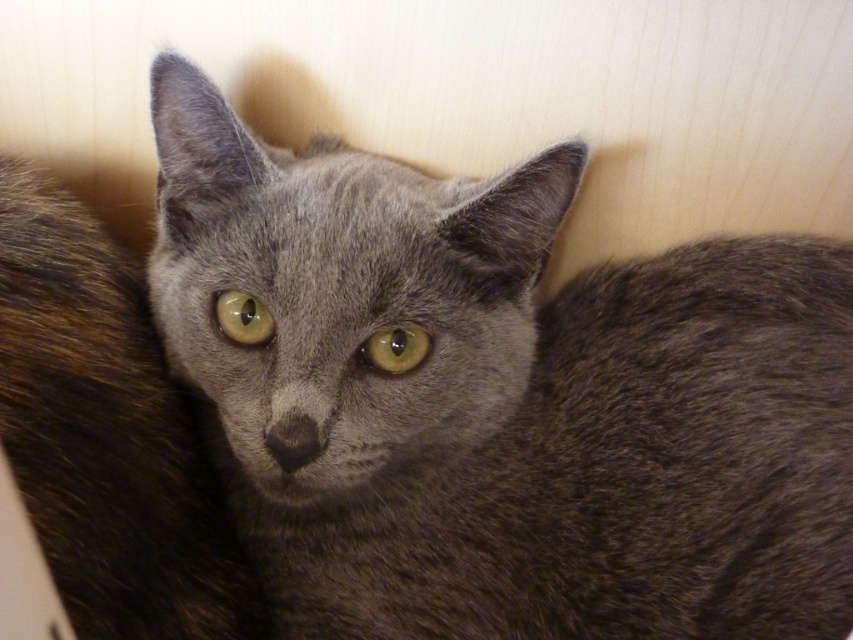
Is point (413, 346) closer to viewer compared to point (236, 316)?

No.

From the picture: Is yellow-green eye at center closer to camera compared to green glossy eye at center?

That is True.

Is point (397, 360) more distant than point (213, 298)?

No, it is in front of (213, 298).

You are a GUI agent. You are given a task and a screenshot of the screen. Output one action in this format:
    pyautogui.click(x=<x>, y=<y>)
    Task: Click on the yellow-green eye at center
    Image resolution: width=853 pixels, height=640 pixels.
    Given the screenshot: What is the action you would take?
    pyautogui.click(x=393, y=348)